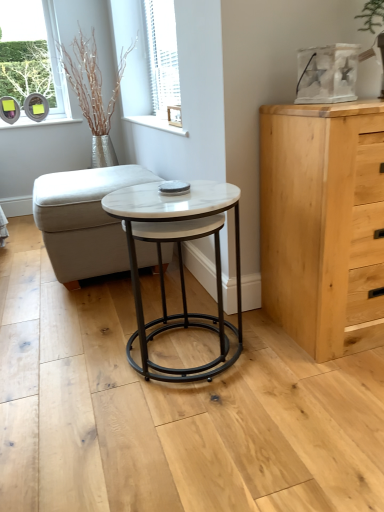
Question: Is light wood chest of drawers at right outside of white fabric ottoman at center?

Choices:
 (A) no
 (B) yes

Answer: (B)

Question: Is light wood chest of drawers at right not close to white fabric ottoman at center?

Choices:
 (A) no
 (B) yes

Answer: (A)

Question: Considering the relative sizes of light wood chest of drawers at right and white fabric ottoman at center in the image provided, is light wood chest of drawers at right shorter than white fabric ottoman at center?

Choices:
 (A) no
 (B) yes

Answer: (A)

Question: Is light wood chest of drawers at right bigger than white fabric ottoman at center?

Choices:
 (A) no
 (B) yes

Answer: (A)

Question: Is light wood chest of drawers at right beside white fabric ottoman at center?

Choices:
 (A) yes
 (B) no

Answer: (B)

Question: Relative to white fabric ottoman at center, is silver metallic vase at upper left in front or behind?

Choices:
 (A) behind
 (B) front

Answer: (A)

Question: Is silver metallic vase at upper left to the left or to the right of white fabric ottoman at center in the image?

Choices:
 (A) right
 (B) left

Answer: (B)

Question: Does point (87, 112) appear closer or farther from the camera than point (72, 192)?

Choices:
 (A) closer
 (B) farther

Answer: (B)

Question: Is silver metallic vase at upper left taller or shorter than white fabric ottoman at center?

Choices:
 (A) tall
 (B) short

Answer: (A)

Question: Is point (170, 376) positioned closer to the camera than point (377, 132)?

Choices:
 (A) farther
 (B) closer

Answer: (A)

Question: Is white marble coffee table at center wider or thinner than light wood chest of drawers at right?

Choices:
 (A) wide
 (B) thin

Answer: (A)

Question: Is white marble coffee table at center bigger or smaller than light wood chest of drawers at right?

Choices:
 (A) small
 (B) big

Answer: (A)

Question: From a real-world perspective, is white marble coffee table at center above or below light wood chest of drawers at right?

Choices:
 (A) above
 (B) below

Answer: (B)

Question: From the image's perspective, is white textured blinds at upper center above or below white fabric ottoman at center?

Choices:
 (A) below
 (B) above

Answer: (B)

Question: In terms of height, does white textured blinds at upper center look taller or shorter compared to white fabric ottoman at center?

Choices:
 (A) tall
 (B) short

Answer: (A)